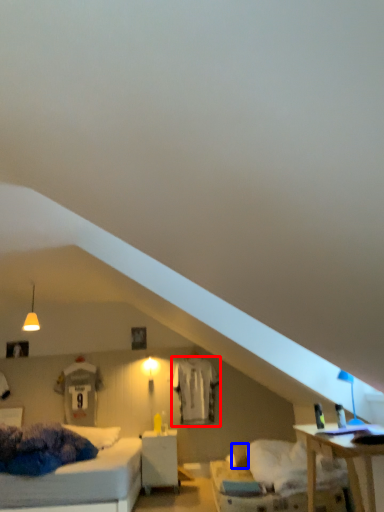
Question: Which object appears closest to the camera in this image, sheet (highlighted by a red box) or pillow (highlighted by a blue box)?

Choices:
 (A) sheet
 (B) pillow

Answer: (B)